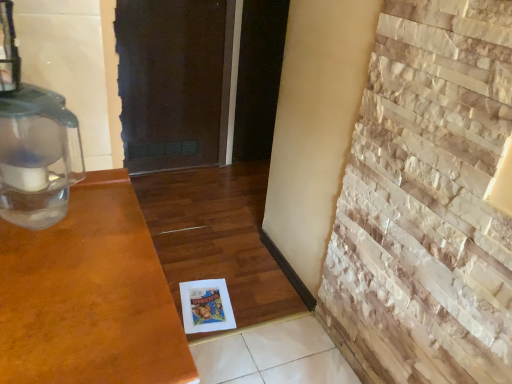
This screenshot has height=384, width=512. Describe the element at coordinates (33, 142) in the screenshot. I see `transparent plastic oil lamp at left` at that location.

This screenshot has width=512, height=384. Find the location of `transparent plastic oil lamp at left`. transparent plastic oil lamp at left is located at coordinates (33, 142).

The width and height of the screenshot is (512, 384). What do you see at coordinates (426, 202) in the screenshot? I see `natural stone fireplace at right` at bounding box center [426, 202].

Image resolution: width=512 pixels, height=384 pixels. In order to click on natural stone fireplace at right in this screenshot , I will do `click(426, 202)`.

In order to face natural stone fireplace at right, should I rotate leftwards or rightwards?

Rotate your view right by about 21.275°.

Find the location of a particular element. transparent plastic oil lamp at left is located at coordinates (33, 142).

Visually, is natural stone fireplace at right positioned to the left or to the right of transparent plastic oil lamp at left?

natural stone fireplace at right is positioned on transparent plastic oil lamp at left's right side.

Is the depth of natural stone fireplace at right greater than that of transparent plastic oil lamp at left?

No, natural stone fireplace at right is closer to the camera.

Considering the points (379, 274) and (54, 216), which point is behind, point (379, 274) or point (54, 216)?

Positioned behind is point (379, 274).

Based on the photo, from the image's perspective, is natural stone fireplace at right on transparent plastic oil lamp at left?

Actually, natural stone fireplace at right appears below transparent plastic oil lamp at left in the image.

From a real-world perspective, is natural stone fireplace at right above or below transparent plastic oil lamp at left?

natural stone fireplace at right is below transparent plastic oil lamp at left.

Looking at their sizes, would you say natural stone fireplace at right is wider or thinner than transparent plastic oil lamp at left?

Considering their sizes, natural stone fireplace at right looks slimmer than transparent plastic oil lamp at left.

Can you confirm if natural stone fireplace at right is taller than transparent plastic oil lamp at left?

Yes.

Can you confirm if natural stone fireplace at right is smaller than transparent plastic oil lamp at left?

No.

Is transparent plastic oil lamp at left located within natural stone fireplace at right?

Definitely not — transparent plastic oil lamp at left is not inside natural stone fireplace at right.

Is natural stone fireplace at right placed right next to transparent plastic oil lamp at left?

No.

Based on the photo, is natural stone fireplace at right looking in the opposite direction of transparent plastic oil lamp at left?

That's not correct — natural stone fireplace at right is not looking away from transparent plastic oil lamp at left.

Find the location of `oil lamp that is on the left side of natural stone fireplace at right`. oil lamp that is on the left side of natural stone fireplace at right is located at coordinates pyautogui.click(x=33, y=142).

Based on their positions, is transparent plastic oil lamp at left located to the left or right of natural stone fireplace at right?

transparent plastic oil lamp at left is positioned on natural stone fireplace at right's left side.

In the image, is transparent plastic oil lamp at left positioned in front of or behind natural stone fireplace at right?

Visually, transparent plastic oil lamp at left is located behind natural stone fireplace at right.

Between point (75, 137) and point (452, 192), which one is positioned in front?

The point (75, 137) is closer to the camera.

From the image's perspective, would you say transparent plastic oil lamp at left is positioned over natural stone fireplace at right?

Yes, from the image's perspective, transparent plastic oil lamp at left is over natural stone fireplace at right.

From a real-world perspective, who is located lower, transparent plastic oil lamp at left or natural stone fireplace at right?

In real-world perspective, natural stone fireplace at right is lower.

Looking at this image, between transparent plastic oil lamp at left and natural stone fireplace at right, which one has larger width?

With larger width is transparent plastic oil lamp at left.

Considering the sizes of objects transparent plastic oil lamp at left and natural stone fireplace at right in the image provided, who is taller, transparent plastic oil lamp at left or natural stone fireplace at right?

Standing taller between the two is natural stone fireplace at right.

Is transparent plastic oil lamp at left smaller than natural stone fireplace at right?

Yes, transparent plastic oil lamp at left is smaller than natural stone fireplace at right.

Is transparent plastic oil lamp at left located outside natural stone fireplace at right?

Indeed, transparent plastic oil lamp at left is completely outside natural stone fireplace at right.

Would you consider transparent plastic oil lamp at left to be distant from natural stone fireplace at right?

No, there isn't a large distance between transparent plastic oil lamp at left and natural stone fireplace at right.

From the picture: Is transparent plastic oil lamp at left facing towards natural stone fireplace at right?

No, transparent plastic oil lamp at left is not facing towards natural stone fireplace at right.

Locate an element on the screen. The image size is (512, 384). brickwork below the transparent plastic oil lamp at left (from the image's perspective) is located at coordinates (426, 202).

Identify the location of oil lamp above the natural stone fireplace at right (from a real-world perspective). The image size is (512, 384). (33, 142).

At what (x,y) coordinates should I click in order to perform the action: click on brickwork located underneath the transparent plastic oil lamp at left (from a real-world perspective). Please return your answer as a coordinate pair (x, y). Looking at the image, I should click on (426, 202).